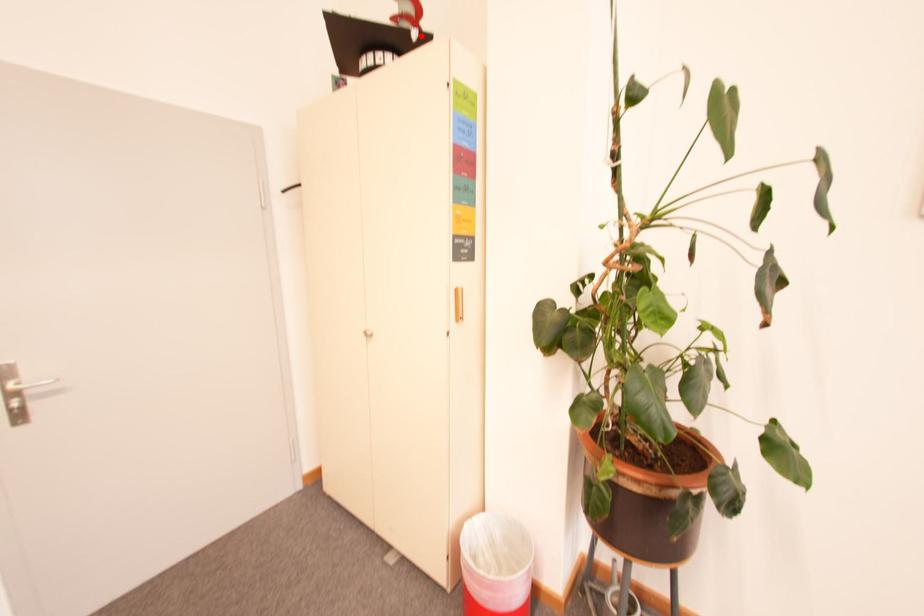
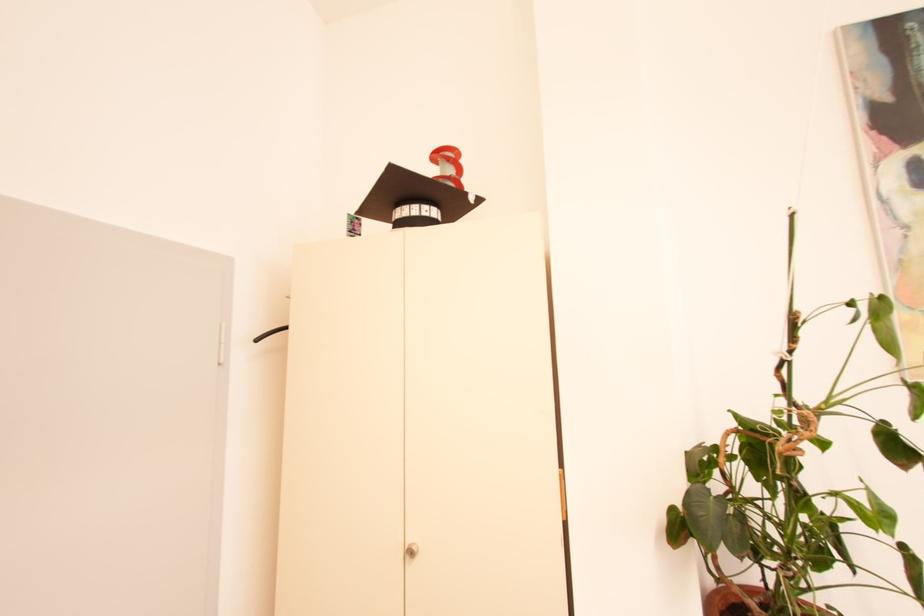
Question: I am providing you with two images of the same scene from different viewpoints. A red point is marked on the first image. Is the red point's position out of view in image 2?

Choices:
 (A) Yes
 (B) No

Answer: (B)